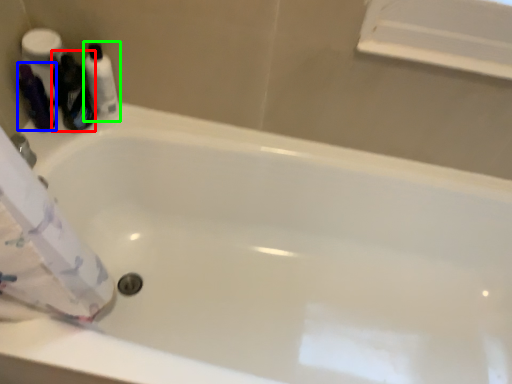
Question: Which object is positioned closest to cleaning product (highlighted by a red box)? Select from toiletry (highlighted by a blue box) and toiletry (highlighted by a green box).

Choices:
 (A) toiletry
 (B) toiletry

Answer: (B)